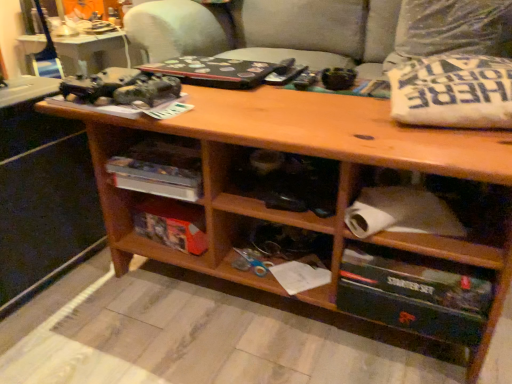
Question: Is point (353, 281) positioned closer to the camera than point (444, 64)?

Choices:
 (A) closer
 (B) farther

Answer: (A)

Question: In the image, is black cardboard starter set at lower right positioned in front of or behind white cotton pillow at upper right, arranged as the 2th pillow when viewed from the top?

Choices:
 (A) front
 (B) behind

Answer: (B)

Question: Based on their relative distances, which object is nearer to the wooden shelf at center?

Choices:
 (A) white fabric pillow at upper right, acting as the first pillow starting from the top
 (B) black cardboard starter set at lower right
 (C) white cotton pillow at upper right, arranged as the 2th pillow when viewed from the top
 (D) orange cardboard box at center
 (E) white paper at lower right

Answer: (D)

Question: Which object is positioned farthest from the white paper at lower right?

Choices:
 (A) orange cardboard box at center
 (B) white fabric pillow at upper right, placed as the second pillow when sorted from bottom to top
 (C) white cotton pillow at upper right, arranged as the 2th pillow when viewed from the back
 (D) wooden shelf at center
 (E) black cardboard starter set at lower right

Answer: (B)